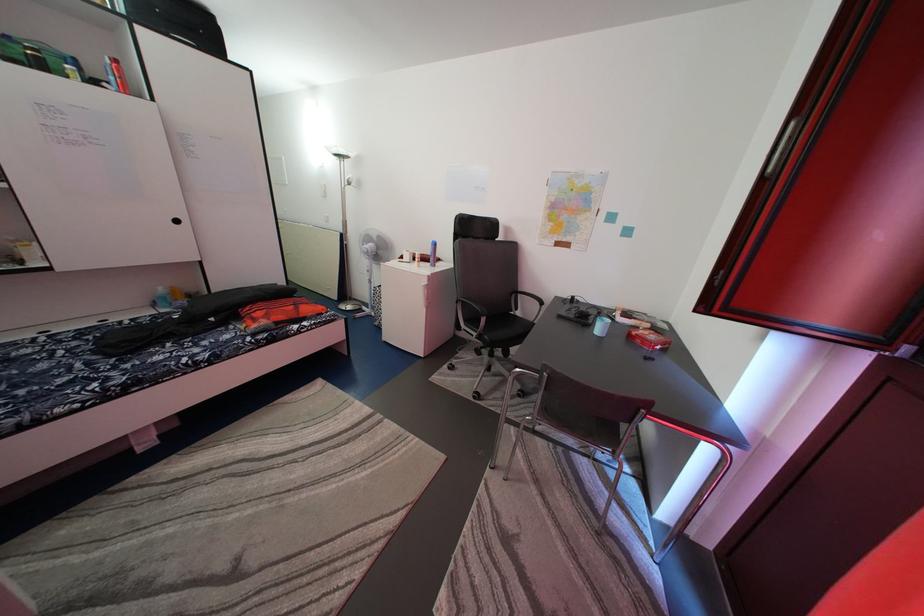
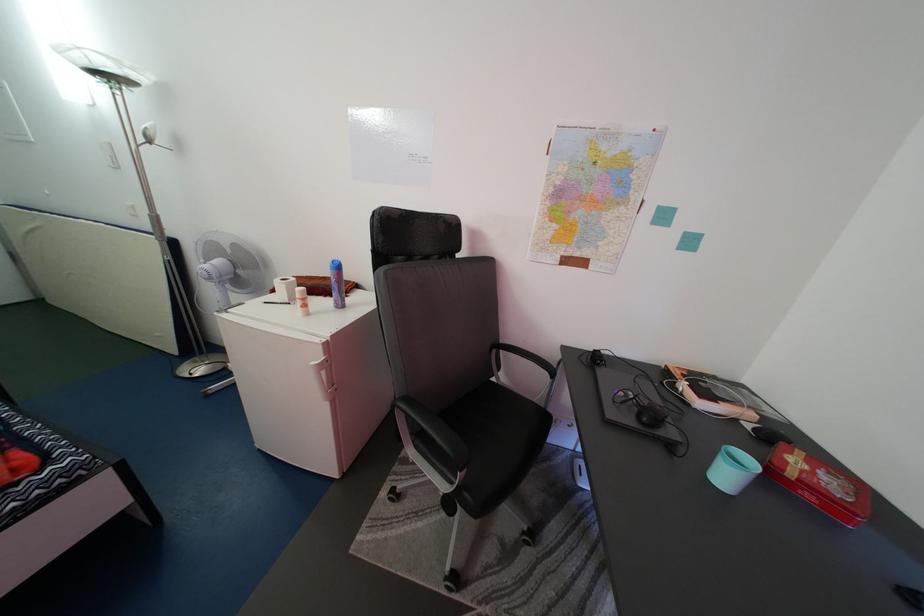
In the second image, find the point that corresponds to point (408, 267) in the first image.

(280, 304)